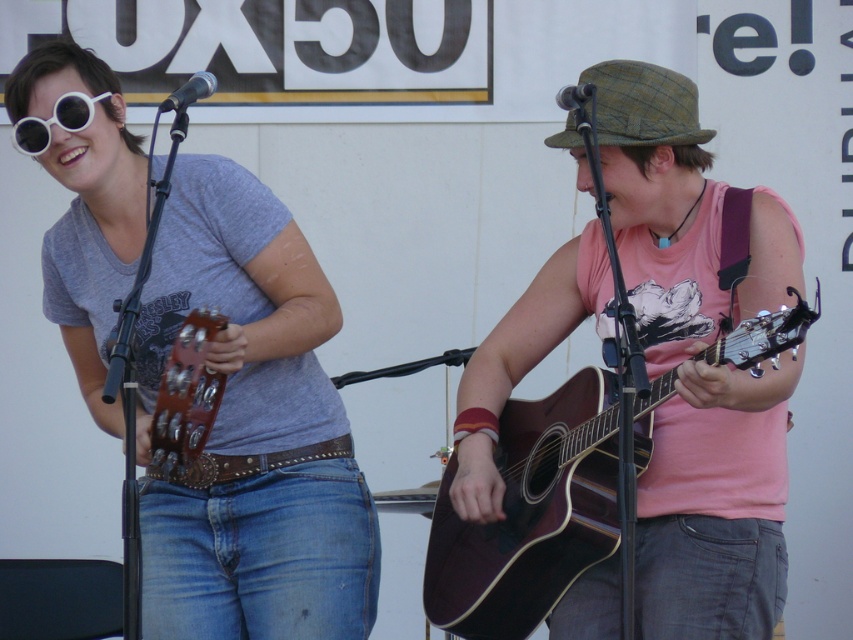
You are a stagehand setting up a narrow storage rack that can only accommodate one guitar at a time. You need to place the dark brown acoustic guitar at center and the wooden acoustic guitar at left into the rack. Based on their widths, which guitar should you place first?

The dark brown acoustic guitar at center might be wider than wooden acoustic guitar at left, so you should place the dark brown acoustic guitar at center first to ensure it fits in the rack.

Consider the image. You are a stagehand setting up for a concert. You need to place a new microphone stand between the dark brown acoustic guitar at center and the wooden acoustic guitar at left. Based on their positions, which guitar should the microphone stand be closer to?

The microphone stand should be placed closer to the wooden acoustic guitar at left since the dark brown acoustic guitar at center is to the right of the wooden acoustic guitar at left.